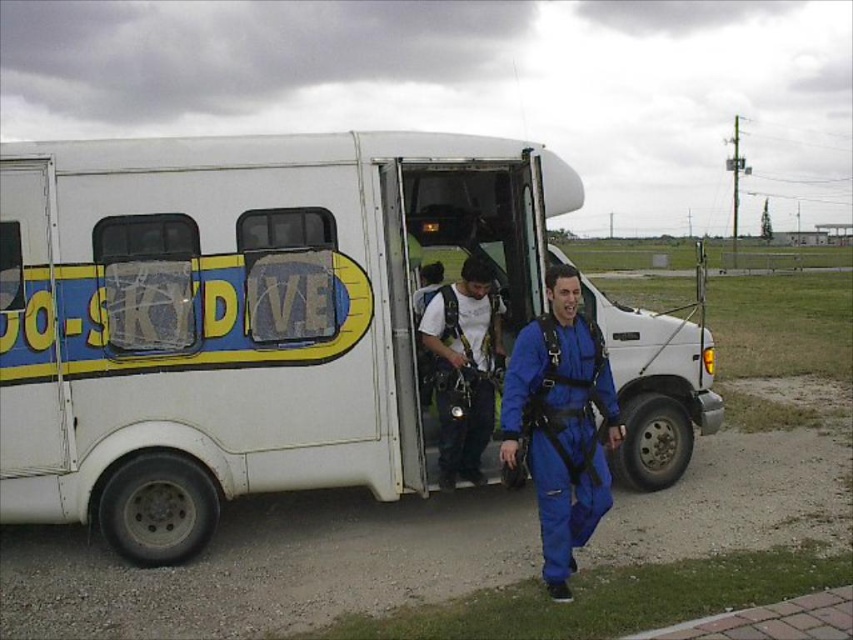
Who is more distant from viewer, (347, 216) or (541, 442)?

Point (347, 216)

From the picture: Does white matte van at center come behind blue matte jumpsuit at center?

That is True.

Image resolution: width=853 pixels, height=640 pixels. I want to click on white matte van at center, so 238,316.

Where is `white matte van at center`? white matte van at center is located at coordinates (238, 316).

From the picture: Is white matte van at center shorter than blue fabric jumpsuit at center?

No.

Does white matte van at center have a larger size compared to blue fabric jumpsuit at center?

Yes.

What do you see at coordinates (238, 316) in the screenshot? The width and height of the screenshot is (853, 640). I see `white matte van at center` at bounding box center [238, 316].

I want to click on white matte van at center, so click(x=238, y=316).

Can you confirm if blue matte jumpsuit at center is smaller than blue fabric jumpsuit at center?

Yes, blue matte jumpsuit at center is smaller than blue fabric jumpsuit at center.

Who is more forward, [585,445] or [479,408]?

Point [585,445]

Locate an element on the screen. blue matte jumpsuit at center is located at coordinates (561, 422).